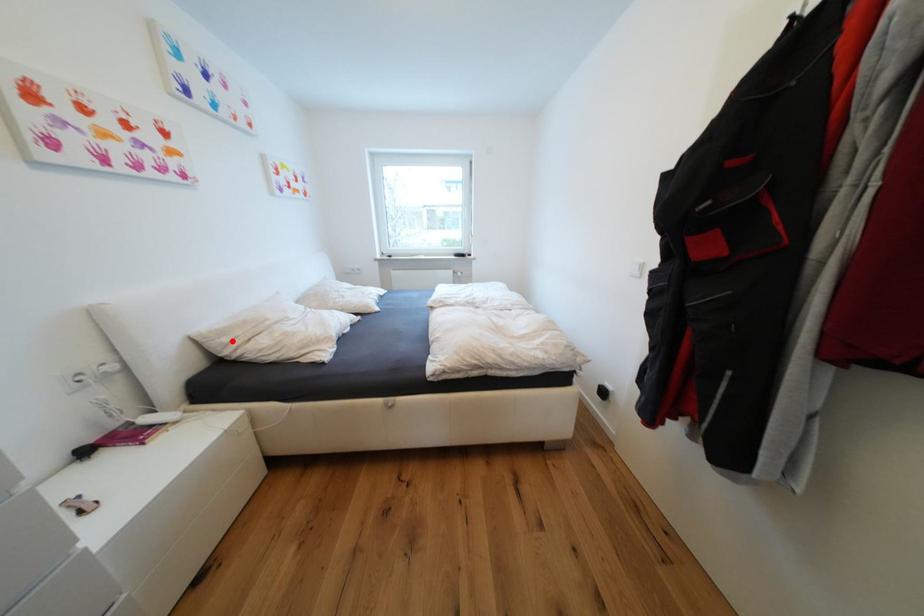
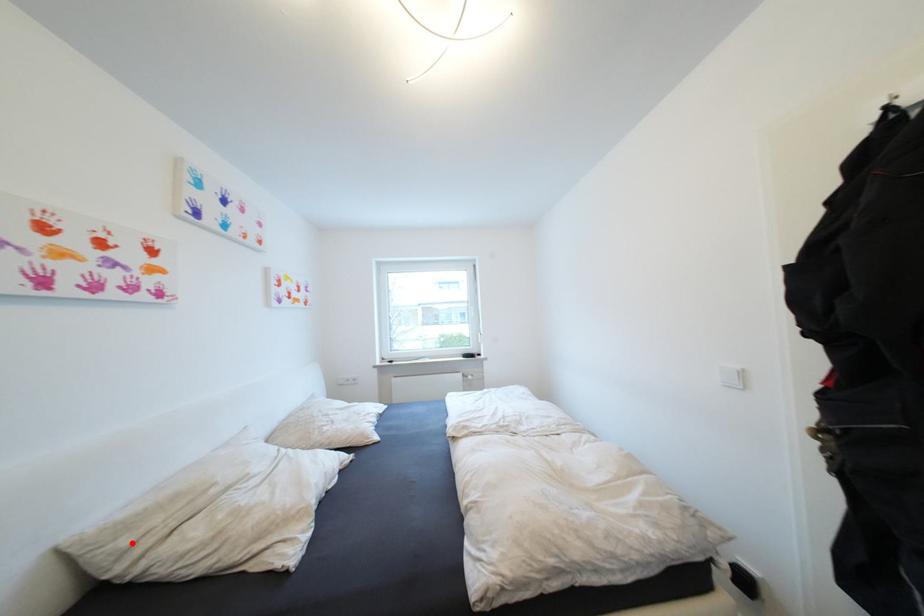
From the picture: I am providing you with two images of the same scene from different viewpoints. A red point is marked on the first image and another point is marked on the second image. Is the marked point in image1 the same physical position as the marked point in image2?

Yes